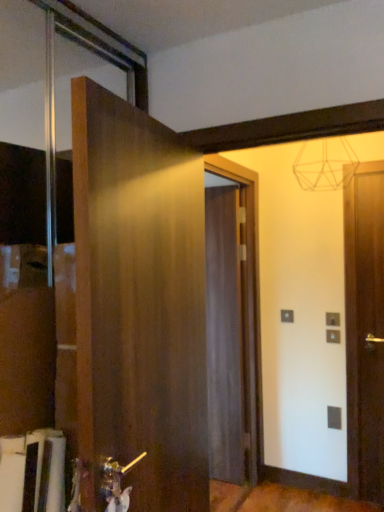
Question: Considering the relative sizes of wooden door at left, the 1th door when ordered from left to right, and matte wood door at center, the 2th door in the front-to-back sequence, in the image provided, is wooden door at left, the 1th door when ordered from left to right, bigger than matte wood door at center, the 2th door in the front-to-back sequence,?

Choices:
 (A) yes
 (B) no

Answer: (A)

Question: Is wooden door at left, positioned as the 2th door in back-to-front order, shorter than matte wood door at center, which is the 1th door in right-to-left order?

Choices:
 (A) yes
 (B) no

Answer: (A)

Question: Does wooden door at left, positioned as the 1th door in front-to-back order, have a smaller size compared to matte wood door at center, which ranks as the first door in back-to-front order?

Choices:
 (A) yes
 (B) no

Answer: (B)

Question: Considering the relative positions of wooden door at left, positioned as the 1th door in front-to-back order, and matte wood door at center, which is the 1th door in right-to-left order, in the image provided, is wooden door at left, positioned as the 1th door in front-to-back order, to the left of matte wood door at center, which is the 1th door in right-to-left order, from the viewer's perspective?

Choices:
 (A) no
 (B) yes

Answer: (B)

Question: Is wooden door at left, positioned as the 2th door in back-to-front order, directly adjacent to matte wood door at center, which ranks as the first door in back-to-front order?

Choices:
 (A) yes
 (B) no

Answer: (B)

Question: Is matte wood door at center, which is the 2th door from left to right, aimed at wooden door at left, the second door from the right?

Choices:
 (A) no
 (B) yes

Answer: (A)

Question: Can you confirm if matte wood door at center, the 2th door in the front-to-back sequence, is shorter than wooden door at left, the second door from the right?

Choices:
 (A) no
 (B) yes

Answer: (A)

Question: From the image's perspective, is matte wood door at center, the 2th door in the front-to-back sequence, beneath wooden door at left, positioned as the 1th door in front-to-back order?

Choices:
 (A) no
 (B) yes

Answer: (B)

Question: From a real-world perspective, is matte wood door at center, which is the 1th door in right-to-left order, on wooden door at left, positioned as the 1th door in front-to-back order?

Choices:
 (A) yes
 (B) no

Answer: (B)

Question: Is matte wood door at center, the 2th door in the front-to-back sequence, located outside wooden door at left, the second door from the right?

Choices:
 (A) yes
 (B) no

Answer: (A)

Question: Is matte wood door at center, which ranks as the first door in back-to-front order, closer to the viewer compared to wooden door at left, positioned as the 1th door in front-to-back order?

Choices:
 (A) no
 (B) yes

Answer: (A)

Question: In the image, is matte wood door at center, which ranks as the first door in back-to-front order, on the left side or the right side of wooden door at left, positioned as the 1th door in front-to-back order?

Choices:
 (A) left
 (B) right

Answer: (B)